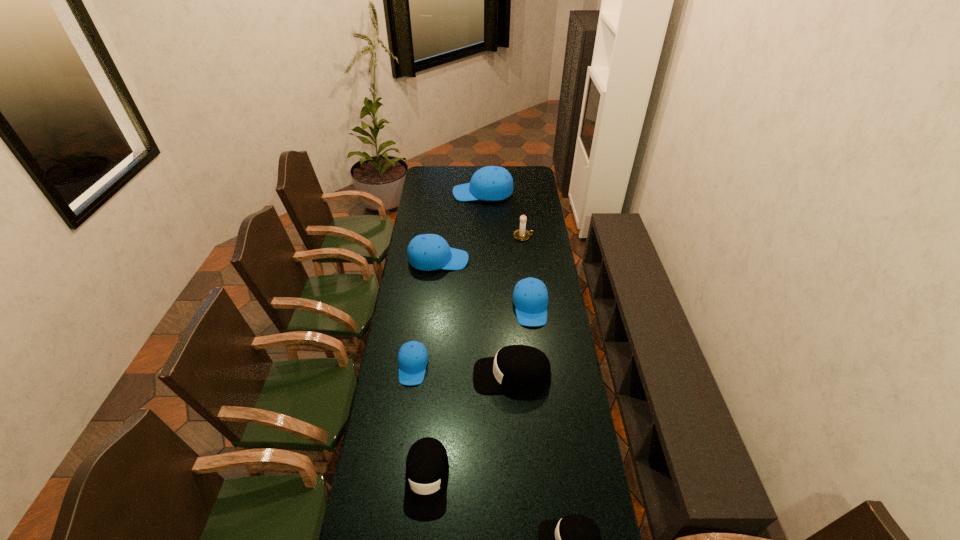
You are a GUI agent. You are given a task and a screenshot of the screen. Output one action in this format:
    pyautogui.click(x=<x>, y=<y>)
    Task: Click on the smallest blue cap
    This screenshot has height=540, width=960.
    Given the screenshot: What is the action you would take?
    pyautogui.click(x=413, y=358)

This screenshot has height=540, width=960. Find the location of `free point located 0.170m on the front-facing side of the farthest blue cap`. free point located 0.170m on the front-facing side of the farthest blue cap is located at coordinates (424, 193).

You are a GUI agent. You are given a task and a screenshot of the screen. Output one action in this format:
    pyautogui.click(x=<x>, y=<y>)
    Task: Click on the blank space located 0.180m on the front-facing side of the farthest blue cap
    
    Given the screenshot: What is the action you would take?
    pyautogui.click(x=422, y=193)

In order to click on blank space located on the front-facing side of the farthest blue cap in this screenshot , I will do `click(428, 193)`.

This screenshot has width=960, height=540. Identify the location of free spot located on the front-facing side of the second biggest blue cap. (479, 260).

Locate an element on the screen. Image resolution: width=960 pixels, height=540 pixels. free space located on the handle side of the seventh nearest object is located at coordinates (543, 236).

Where is `vacant area located on the front-facing side of the farthest black cap`? The width and height of the screenshot is (960, 540). vacant area located on the front-facing side of the farthest black cap is located at coordinates (444, 375).

Image resolution: width=960 pixels, height=540 pixels. Find the location of `vacant area situated 0.340m on the front-facing side of the farthest black cap`. vacant area situated 0.340m on the front-facing side of the farthest black cap is located at coordinates (385, 375).

At what (x,y) coordinates should I click in order to perform the action: click on free space located 0.060m on the front-facing side of the farthest black cap. Please return your answer as a coordinate pair (x, y). Looking at the image, I should click on (458, 375).

I want to click on free space located on the front-facing side of the third biggest blue cap, so click(x=535, y=347).